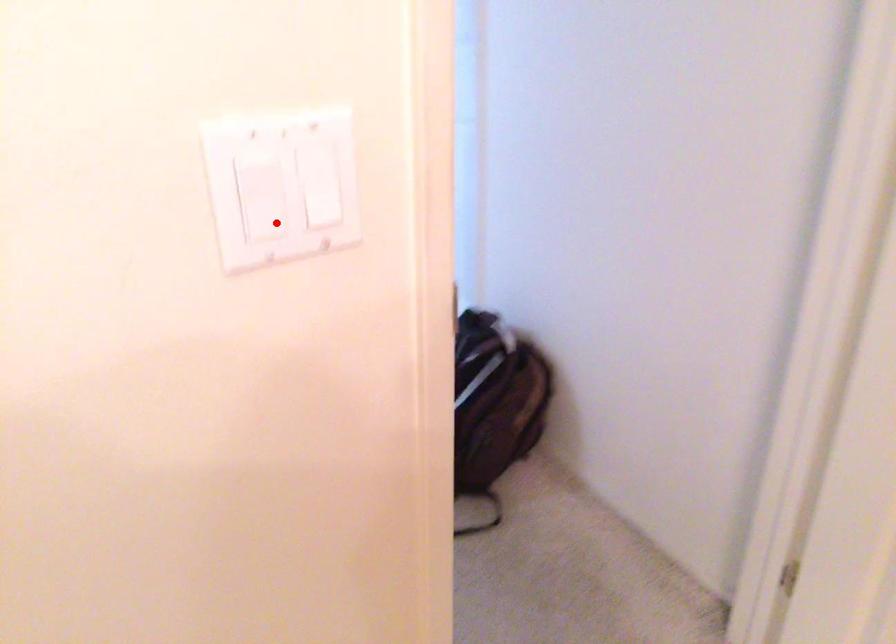
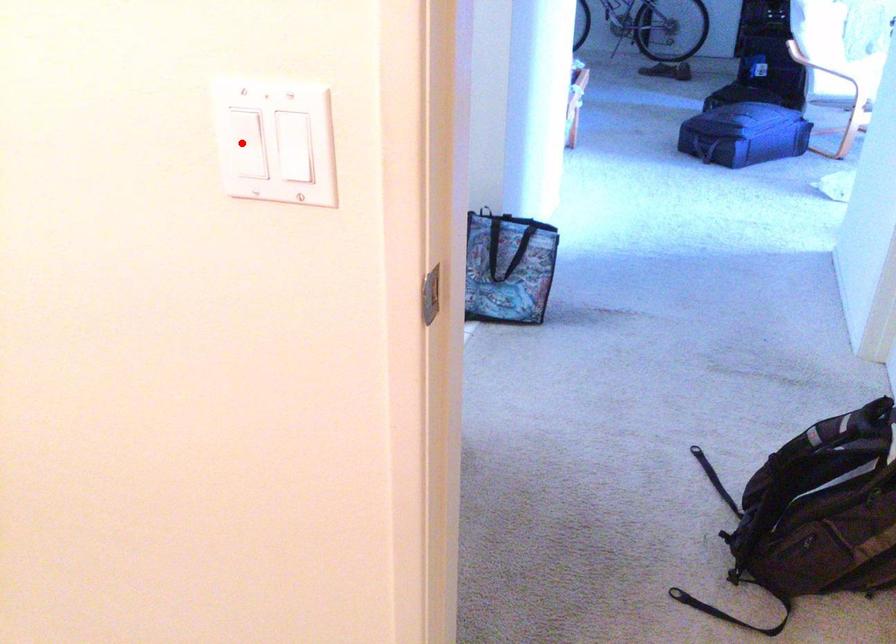
I am providing you with two images of the same scene from different viewpoints. A red point is marked on the first image and another point is marked on the second image. Does the point marked in image1 correspond to the same location as the one in image2?

Yes